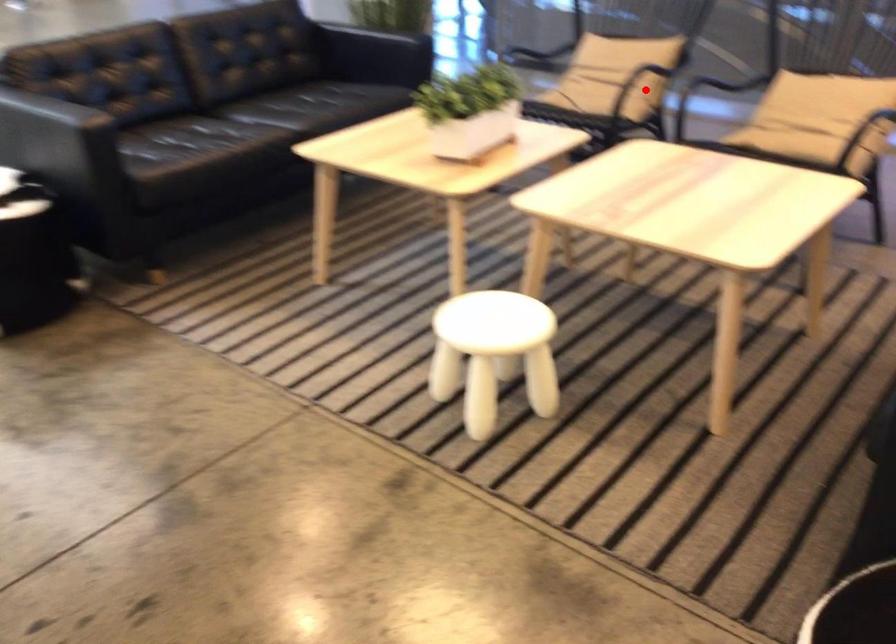
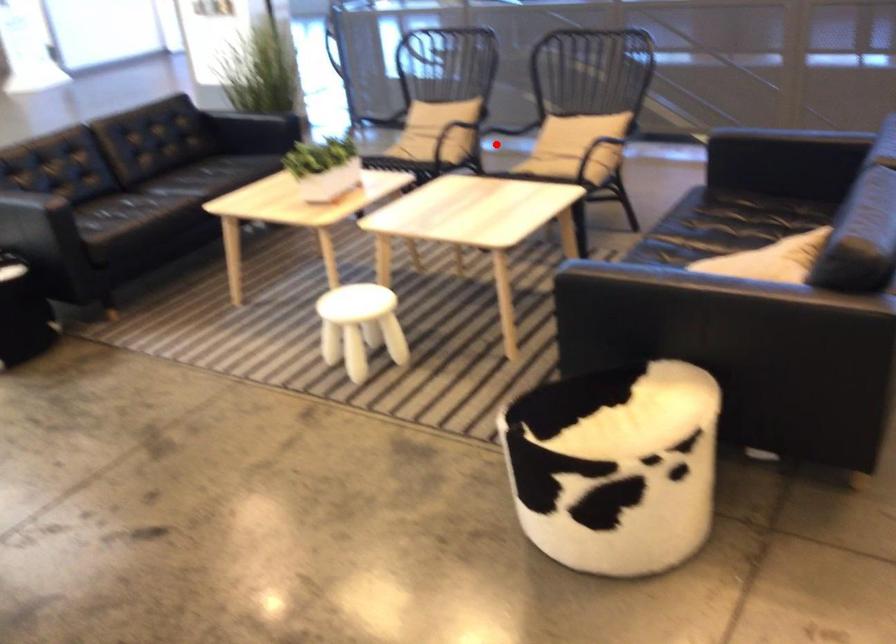
I am providing you with two images of the same scene from different viewpoints. A red point is marked on the first image and another point is marked on the second image. Does the point marked in image1 correspond to the same location as the one in image2?

No